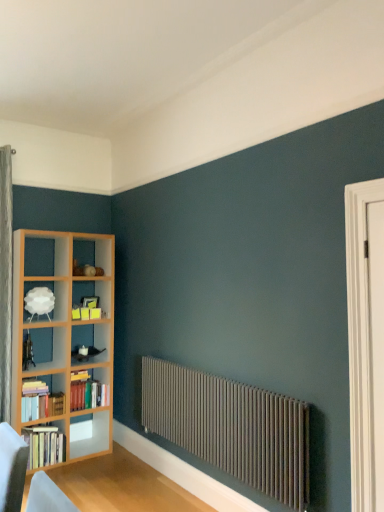
Question: Should I look upward or downward to see hardcover books at left, arranged as the 2th book when ordered from the bottom?

Choices:
 (A) up
 (B) down

Answer: (B)

Question: From a real-world perspective, is white matte lampshade at upper left below hardcover books at left, marked as the 3th book in a bottom-to-top arrangement?

Choices:
 (A) yes
 (B) no

Answer: (B)

Question: Does white matte lampshade at upper left have a larger size compared to hardcover books at left, the 1th book when ordered from top to bottom?

Choices:
 (A) yes
 (B) no

Answer: (B)

Question: Is white matte lampshade at upper left further to the viewer compared to hardcover books at left, the 1th book when ordered from top to bottom?

Choices:
 (A) yes
 (B) no

Answer: (A)

Question: Can you confirm if white matte lampshade at upper left is taller than hardcover books at left, marked as the 3th book in a bottom-to-top arrangement?

Choices:
 (A) yes
 (B) no

Answer: (B)

Question: Is white matte lampshade at upper left oriented towards hardcover books at left, marked as the 3th book in a bottom-to-top arrangement?

Choices:
 (A) no
 (B) yes

Answer: (A)

Question: From the image's perspective, is white matte lampshade at upper left over hardcover books at left, marked as the 3th book in a bottom-to-top arrangement?

Choices:
 (A) yes
 (B) no

Answer: (A)

Question: Is white wooden door at right directly adjacent to hardcover books at left, arranged as the 2th book when ordered from the bottom?

Choices:
 (A) yes
 (B) no

Answer: (B)

Question: Is white wooden door at right to the right of hardcover books at left, which is counted as the second book, starting from the top, from the viewer's perspective?

Choices:
 (A) yes
 (B) no

Answer: (A)

Question: Is white wooden door at right shorter than hardcover books at left, which is counted as the second book, starting from the top?

Choices:
 (A) yes
 (B) no

Answer: (B)

Question: From a real-world perspective, is white wooden door at right beneath hardcover books at left, arranged as the 2th book when ordered from the bottom?

Choices:
 (A) no
 (B) yes

Answer: (A)

Question: Can you confirm if white wooden door at right is positioned to the left of hardcover books at left, which is counted as the second book, starting from the top?

Choices:
 (A) no
 (B) yes

Answer: (A)

Question: Is white wooden door at right thinner than hardcover books at left, which is counted as the second book, starting from the top?

Choices:
 (A) no
 (B) yes

Answer: (B)

Question: Considering the relative positions of white matte lampshade at upper left and hardcover books at left, which ranks as the 3th book in top-to-bottom order, in the image provided, is white matte lampshade at upper left to the left of hardcover books at left, which ranks as the 3th book in top-to-bottom order, from the viewer's perspective?

Choices:
 (A) yes
 (B) no

Answer: (A)